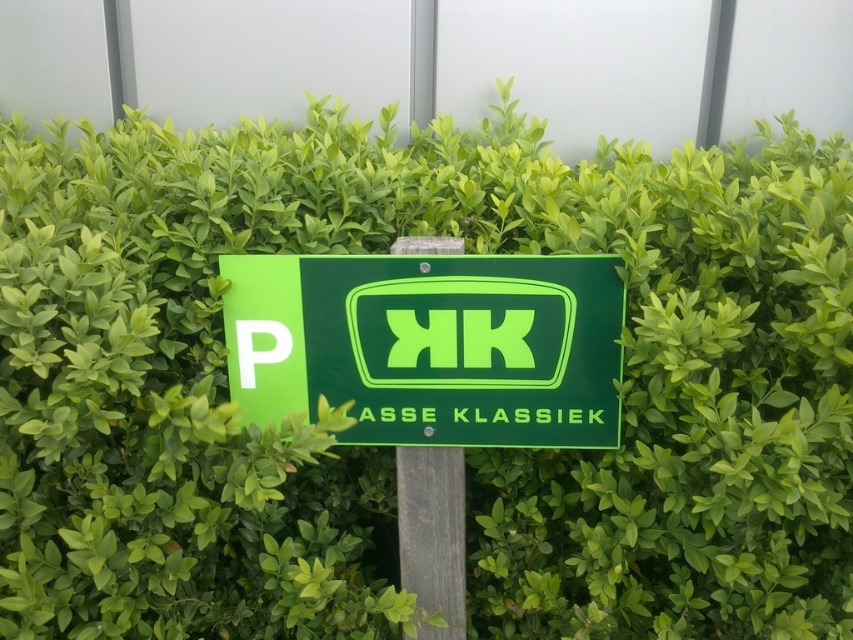
You are a painter who needs to know the relative sizes of the objects to plan your painting. Which object, the neon green plastic sign at center or the wooden post at center, has a greater width?

The neon green plastic sign at center has a greater width than the wooden post at center according to the description.

You are a painter who needs to paint both the neon green plastic sign at center and the wooden post at center. Which object will require more paint due to its size?

The neon green plastic sign at center requires more paint because it has a larger size compared to the wooden post at center.